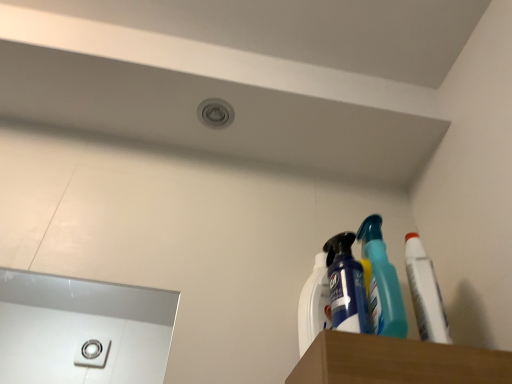
Question: Is white matte toothpaste at right surrounded by blue glossy spray bottle at upper right, the 2th cleaning product viewed from the left?

Choices:
 (A) yes
 (B) no

Answer: (B)

Question: Is blue glossy spray bottle at upper right, arranged as the first cleaning product when viewed from the right, at the left side of white matte toothpaste at right?

Choices:
 (A) no
 (B) yes

Answer: (B)

Question: Is blue glossy spray bottle at upper right, the 2th cleaning product viewed from the left, touching white matte toothpaste at right?

Choices:
 (A) no
 (B) yes

Answer: (A)

Question: Is blue glossy spray bottle at upper right, the 2th cleaning product viewed from the left, smaller than white matte toothpaste at right?

Choices:
 (A) no
 (B) yes

Answer: (A)

Question: Is blue glossy spray bottle at upper right, the 2th cleaning product viewed from the left, far away from white matte toothpaste at right?

Choices:
 (A) yes
 (B) no

Answer: (B)

Question: Considering the positions of blue glossy spray bottle at upper right, arranged as the first cleaning product when viewed from the right, and white matte toothpaste at right in the image, is blue glossy spray bottle at upper right, arranged as the first cleaning product when viewed from the right, wider or thinner than white matte toothpaste at right?

Choices:
 (A) wide
 (B) thin

Answer: (A)

Question: From a real-world perspective, relative to white matte toothpaste at right, is blue glossy spray bottle at upper right, the 2th cleaning product viewed from the left, vertically above or below?

Choices:
 (A) below
 (B) above

Answer: (B)

Question: From the image's perspective, relative to white matte toothpaste at right, is blue glossy spray bottle at upper right, arranged as the first cleaning product when viewed from the right, above or below?

Choices:
 (A) below
 (B) above

Answer: (B)

Question: Considering the positions of point (338, 274) and point (435, 329), is point (338, 274) closer or farther from the camera than point (435, 329)?

Choices:
 (A) farther
 (B) closer

Answer: (A)

Question: Is white plastic spray bottle at upper right, which is the first cleaning product from left to right, spatially inside white matte toothpaste at right, or outside of it?

Choices:
 (A) outside
 (B) inside

Answer: (A)

Question: Visually, is white plastic spray bottle at upper right, which appears as the 2th cleaning product when viewed from the right, positioned to the left or to the right of white matte toothpaste at right?

Choices:
 (A) left
 (B) right

Answer: (A)

Question: From the image's perspective, is white plastic spray bottle at upper right, which appears as the 2th cleaning product when viewed from the right, above or below white matte toothpaste at right?

Choices:
 (A) above
 (B) below

Answer: (B)

Question: Relative to white matte toothpaste at right, is white plastic spray bottle at upper right, which is the first cleaning product from left to right, in front or behind?

Choices:
 (A) front
 (B) behind

Answer: (B)

Question: Considering their positions, is white matte toothpaste at right located in front of or behind white plastic spray bottle at upper right, which is the first cleaning product from left to right?

Choices:
 (A) behind
 (B) front

Answer: (B)

Question: Is white matte toothpaste at right bigger or smaller than white plastic spray bottle at upper right, which appears as the 2th cleaning product when viewed from the right?

Choices:
 (A) big
 (B) small

Answer: (A)